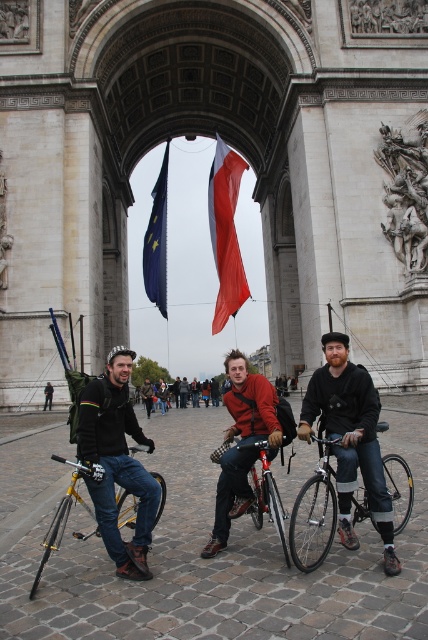
How far apart are matte black jacket at center and blue fabric flag at center?

51.01 meters

Is matte black jacket at center further to the viewer compared to blue fabric flag at center?

That is False.

The image size is (428, 640). Find the location of `matte black jacket at center`. matte black jacket at center is located at coordinates (116, 461).

Which is in front, point (249, 486) or point (157, 236)?

Point (249, 486)

Is red-orange sweater at center to the left of blue fabric flag at center from the viewer's perspective?

In fact, red-orange sweater at center is to the right of blue fabric flag at center.

Is point (216, 531) farther from viewer compared to point (157, 196)?

No, (216, 531) is in front of (157, 196).

Identify the location of red-orange sweater at center. Image resolution: width=428 pixels, height=640 pixels. (250, 404).

Who is more forward, (109, 472) or (231, 170)?

Point (109, 472) is in front.

Is matte black jacket at center taller than red fabric flag at center?

Incorrect, matte black jacket at center's height is not larger of red fabric flag at center's.

The height and width of the screenshot is (640, 428). Describe the element at coordinates (116, 461) in the screenshot. I see `matte black jacket at center` at that location.

Identify the location of matte black jacket at center. (116, 461).